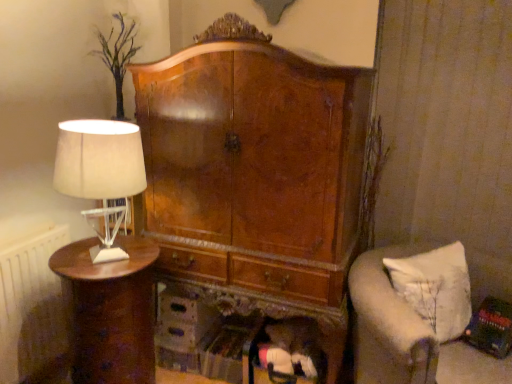
Locate an element on the screen. The width and height of the screenshot is (512, 384). free spot below white fabric lampshade at left (from a real-world perspective) is located at coordinates (104, 253).